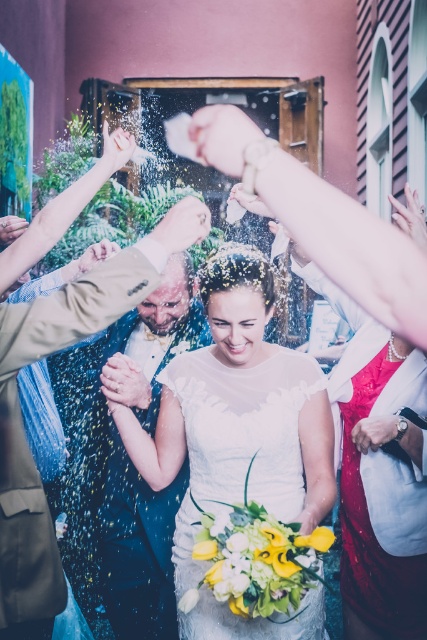
Question: Which point is closer to the camera?

Choices:
 (A) (321, 412)
 (B) (120, 280)

Answer: (B)

Question: Is white sheer dress at center further to the viewer compared to light brown leather jacket at center?

Choices:
 (A) no
 (B) yes

Answer: (B)

Question: Is white sheer dress at center to the left of light brown leather jacket at center from the viewer's perspective?

Choices:
 (A) yes
 (B) no

Answer: (B)

Question: Which point is closer to the camera?

Choices:
 (A) white sheer dress at center
 (B) light brown leather jacket at center

Answer: (B)

Question: Which point is farther to the camera?

Choices:
 (A) (213, 605)
 (B) (15, 531)

Answer: (A)

Question: Considering the relative positions of white sheer dress at center and light brown leather jacket at center in the image provided, where is white sheer dress at center located with respect to light brown leather jacket at center?

Choices:
 (A) below
 (B) above

Answer: (A)